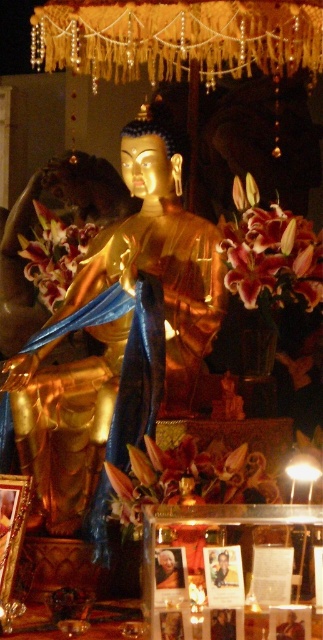
In the scene shown: Can you confirm if pink silk lily at center is positioned to the right of pink lily at left?

Indeed, pink silk lily at center is positioned on the right side of pink lily at left.

Who is more distant from viewer, (280, 230) or (30, 260)?

The point (30, 260) is more distant.

At what (x,y) coordinates should I click in order to perform the action: click on pink silk lily at center. Please return your answer as a coordinate pair (x, y). This screenshot has width=323, height=640. Looking at the image, I should click on (270, 252).

Who is more forward, (127, 512) or (85, 248)?

Point (127, 512) is in front.

In the scene shown: Can you confirm if matte gold statue at center is shorter than pink lily at left?

Yes.

Is point (272, 502) closer to viewer compared to point (48, 273)?

Yes, it is.

The width and height of the screenshot is (323, 640). Find the location of `matte gold statue at center`. matte gold statue at center is located at coordinates (187, 477).

Is gold polished statue at center smaller than pink lily at left?

Actually, gold polished statue at center might be larger than pink lily at left.

Which is below, gold polished statue at center or pink lily at left?

gold polished statue at center is lower down.

Who is more forward, (181, 243) or (40, 227)?

Point (181, 243) is more forward.

Find the location of a particular element. The width and height of the screenshot is (323, 640). gold polished statue at center is located at coordinates (117, 337).